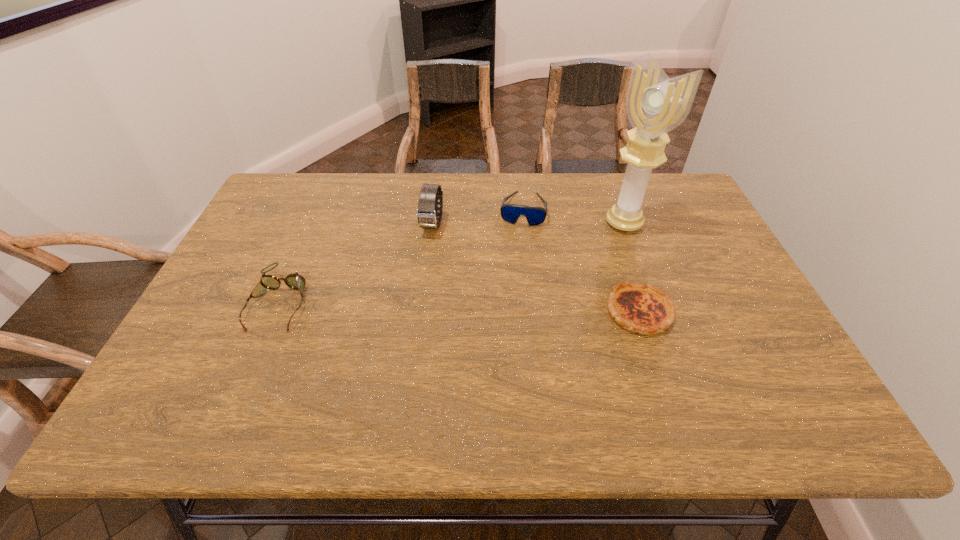
Where is `vacant space in between the leftmost object and the fourth object from right to left`? The width and height of the screenshot is (960, 540). vacant space in between the leftmost object and the fourth object from right to left is located at coordinates (356, 263).

I want to click on vacant space in between the shortest object and the second tallest object, so click(536, 268).

Locate an element on the screen. free space between the quiche and the leftmost object is located at coordinates (460, 306).

At what (x,y) coordinates should I click in order to perform the action: click on unoccupied area between the shortest object and the third shortest object. Please return your answer as a coordinate pair (x, y). The image size is (960, 540). Looking at the image, I should click on (581, 260).

Locate an element on the screen. This screenshot has height=540, width=960. free space between the leftmost object and the shortest object is located at coordinates (460, 306).

This screenshot has width=960, height=540. What are the coordinates of `empty space between the sunglasses and the shortest object` in the screenshot? It's located at (581, 260).

Where is `free space between the spectacles and the tallest object`? The image size is (960, 540). free space between the spectacles and the tallest object is located at coordinates (452, 262).

This screenshot has width=960, height=540. Find the location of `vacant point located between the fourth tallest object and the tallest object`. vacant point located between the fourth tallest object and the tallest object is located at coordinates (452, 262).

Locate an element on the screen. empty space that is in between the fourth shortest object and the shortest object is located at coordinates (536, 268).

The width and height of the screenshot is (960, 540). What are the coordinates of `free spot between the shortest object and the tallest object` in the screenshot? It's located at (632, 267).